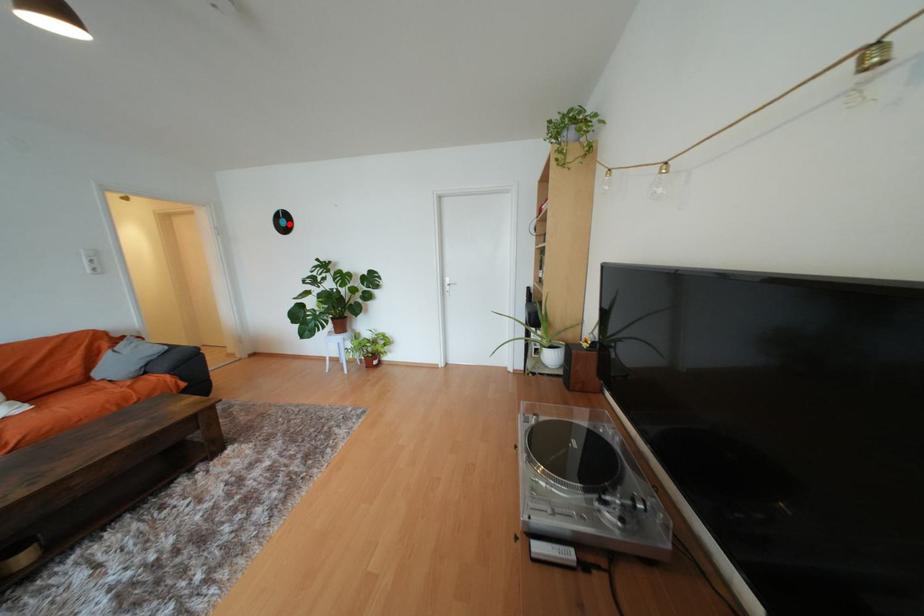
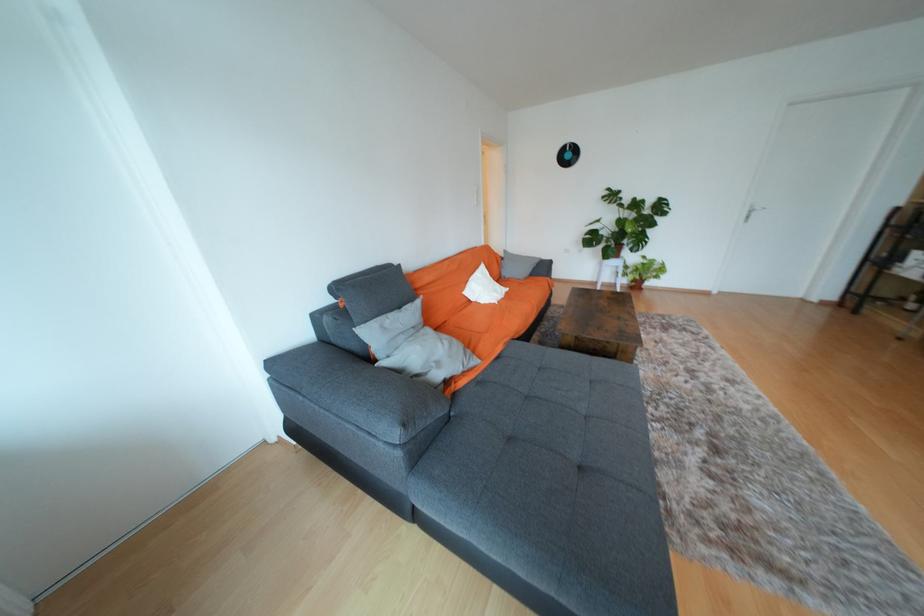
Question: I am providing you with two images of the same scene from different viewpoints. Image1 has a red point marked. In image2, the corresponding 3D location appears at what relative position? Reply with the corresponding letter.

Choices:
 (A) Closer
 (B) Farther

Answer: (B)